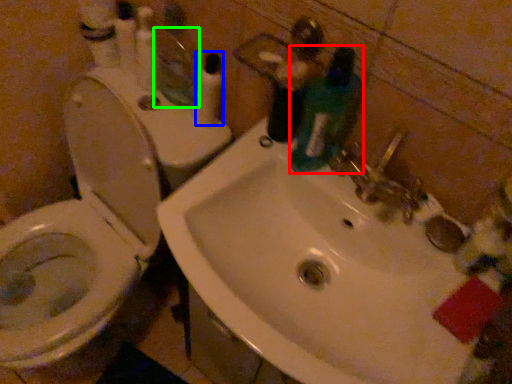
Question: Which object is the farthest from cleaning product (highlighted by a red box)? Choose among these: toiletry (highlighted by a blue box) or mirror (highlighted by a green box).

Choices:
 (A) toiletry
 (B) mirror

Answer: (B)